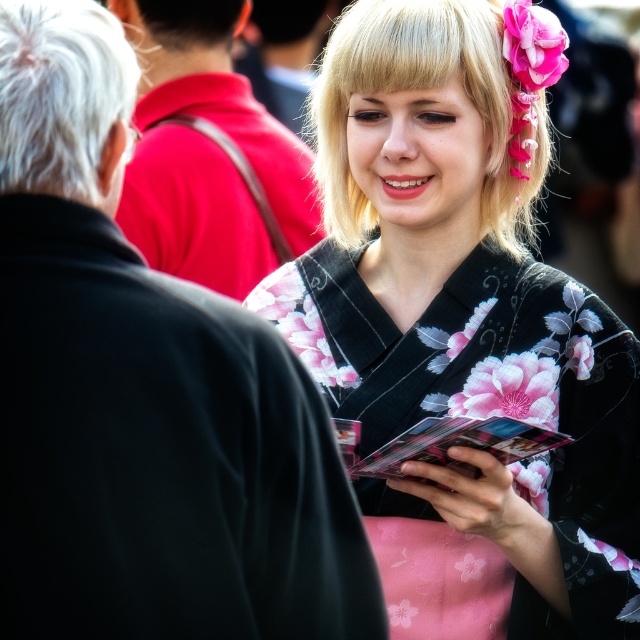
Is black floral kimono at center bigger than matte black kimono at upper right?

Indeed, black floral kimono at center has a larger size compared to matte black kimono at upper right.

Does black floral kimono at center appear on the left side of matte black kimono at upper right?

In fact, black floral kimono at center is to the right of matte black kimono at upper right.

Locate an element on the screen. Image resolution: width=640 pixels, height=640 pixels. black floral kimono at center is located at coordinates (461, 330).

Can you confirm if matte black kimono at upper right is smaller than white matte hair at left?

Actually, matte black kimono at upper right might be larger than white matte hair at left.

Which is more to the left, matte black kimono at upper right or white matte hair at left?

matte black kimono at upper right is more to the left.

Where is `matte black kimono at upper right`? The width and height of the screenshot is (640, 640). matte black kimono at upper right is located at coordinates (214, 186).

Between blonde hair at upper center and white matte hair at left, which one appears on the left side from the viewer's perspective?

From the viewer's perspective, white matte hair at left appears more on the left side.

Who is more forward, [522,42] or [8,42]?

Point [8,42] is more forward.

Which is in front, point (333, 35) or point (80, 173)?

Point (80, 173)

Identify the location of blonde hair at upper center. (442, 84).